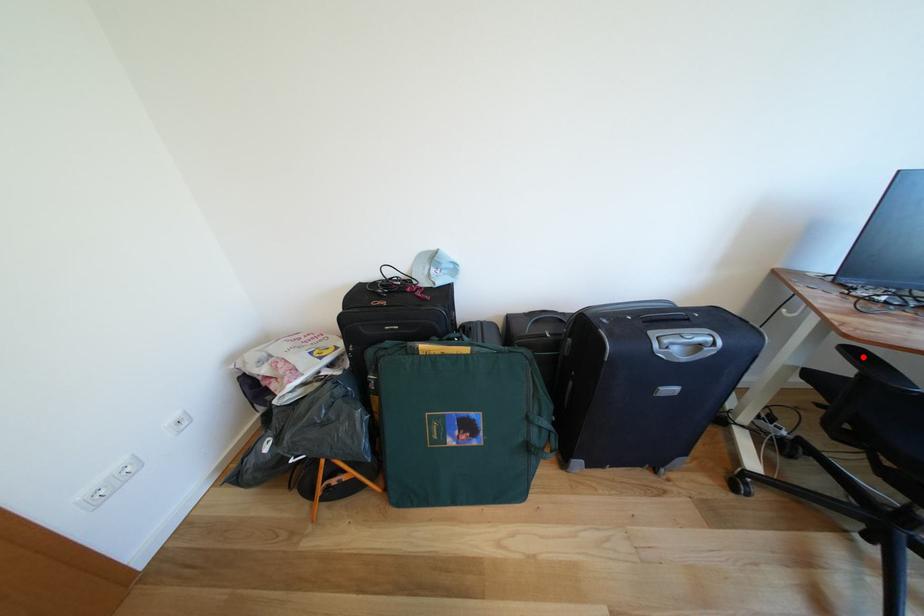
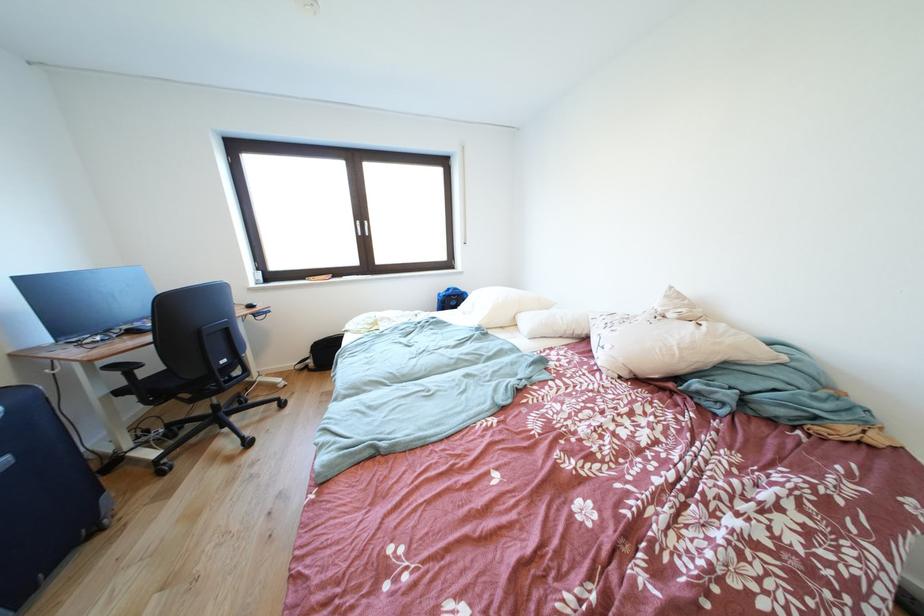
Question: I am providing you with two images of the same scene from different viewpoints. Image1 has a red point marked. In image2, the corresponding 3D location appears at what relative position? Reply with the corresponding letter.

Choices:
 (A) Closer
 (B) Farther

Answer: (A)